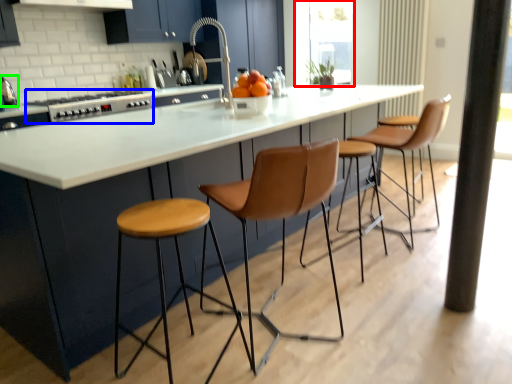
Question: Considering the real-world distances, which object is closest to window screen (highlighted by a red box)? appliance (highlighted by a blue box) or kitchen appliance (highlighted by a green box).

Choices:
 (A) appliance
 (B) kitchen appliance

Answer: (A)